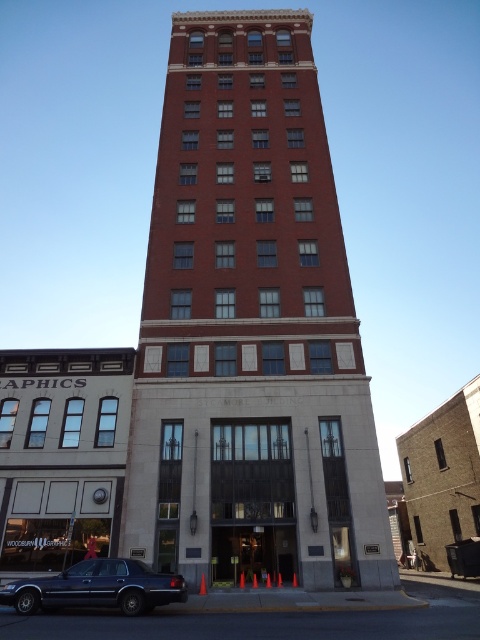
Question: Which point is closer to the camera taking this photo?

Choices:
 (A) (178, 576)
 (B) (330, 538)

Answer: (A)

Question: Among these objects, which one is farthest from the camera?

Choices:
 (A) metallic silver clock at center
 (B) shiny dark blue sedan at lower left
 (C) red brick building at center

Answer: (A)

Question: Is red brick building at center to the left of shiny dark blue sedan at lower left from the viewer's perspective?

Choices:
 (A) no
 (B) yes

Answer: (A)

Question: Can you confirm if red brick building at center is positioned to the left of shiny dark blue sedan at lower left?

Choices:
 (A) no
 (B) yes

Answer: (A)

Question: Is red brick building at center above metallic silver clock at center?

Choices:
 (A) no
 (B) yes

Answer: (B)

Question: Estimate the real-world distances between objects in this image. Which object is farther from the red brick building at center?

Choices:
 (A) shiny dark blue sedan at lower left
 (B) metallic silver clock at center

Answer: (B)